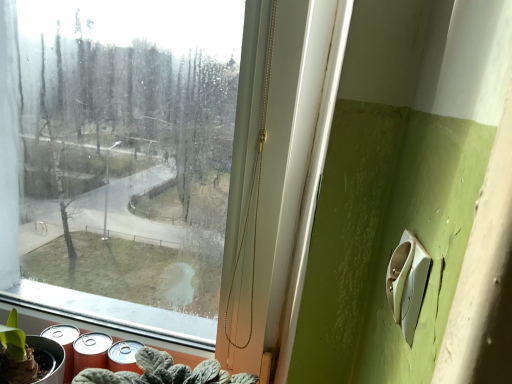
You are a GUI agent. You are given a task and a screenshot of the screen. Output one action in this format:
    pyautogui.click(x=<x>, y=<y>)
    Task: Click on the white plastic light switch at lower right
    This screenshot has height=384, width=512.
    Given the screenshot: What is the action you would take?
    pyautogui.click(x=407, y=283)

Find the location of a particular element. Image resolution: width=512 pixels, height=384 pixels. transparent glass window at center is located at coordinates (119, 145).

Does metallic silver spray can at lower left have a larger size compared to white plastic light switch at lower right?

Yes.

How many degrees apart are the facing directions of metallic silver spray can at lower left and white plastic light switch at lower right?

91.7 degrees.

Is metallic silver spray can at lower left behind white plastic light switch at lower right?

Yes, metallic silver spray can at lower left is further from the viewer.

Are metallic silver spray can at lower left and white plastic light switch at lower right beside each other?

No, metallic silver spray can at lower left is not beside white plastic light switch at lower right.

Can you confirm if green matte plant at lower left is shorter than white plastic light switch at lower right?

No, green matte plant at lower left is not shorter than white plastic light switch at lower right.

Could you tell me if green matte plant at lower left is turned towards white plastic light switch at lower right?

No, green matte plant at lower left does not turn towards white plastic light switch at lower right.

How many degrees apart are the facing directions of green matte plant at lower left and white plastic light switch at lower right?

They differ by 89.6 degrees in their facing directions.

From the image's perspective, between green matte plant at lower left and white plastic light switch at lower right, which one is located above?

white plastic light switch at lower right, from the image's perspective.

Is white plastic light switch at lower right directly adjacent to metallic silver spray can at lower left?

No, white plastic light switch at lower right is not in contact with metallic silver spray can at lower left.

From the image's perspective, is white plastic light switch at lower right above metallic silver spray can at lower left?

Yes.

In terms of width, does white plastic light switch at lower right look wider or thinner when compared to metallic silver spray can at lower left?

white plastic light switch at lower right is thinner than metallic silver spray can at lower left.

Can you confirm if white plastic light switch at lower right is bigger than metallic silver spray can at lower left?

No.

From the image's perspective, is metallic silver spray can at lower left located above or below transparent glass window at center?

metallic silver spray can at lower left is below transparent glass window at center.

From a real-world perspective, which object stands above the other?

From a 3D spatial view, transparent glass window at center is above.

Is metallic silver spray can at lower left in contact with transparent glass window at center?

No, metallic silver spray can at lower left is not with transparent glass window at center.

Is transparent glass window at center located outside white plastic light switch at lower right?

transparent glass window at center lies outside white plastic light switch at lower right's area.

Considering the points (222, 5) and (410, 268), which point is in front, point (222, 5) or point (410, 268)?

Positioned in front is point (410, 268).

From a real-world perspective, is transparent glass window at center positioned over white plastic light switch at lower right based on gravity?

No, from a real-world perspective, transparent glass window at center is not above white plastic light switch at lower right.

How many degrees apart are the facing directions of transparent glass window at center and green matte plant at lower left?

The angle between the facing direction of transparent glass window at center and the facing direction of green matte plant at lower left is 0.0154 degrees.

Which of these two, transparent glass window at center or green matte plant at lower left, is thinner?

With smaller width is green matte plant at lower left.

Between transparent glass window at center and green matte plant at lower left, which one is positioned in front?

transparent glass window at center is closer to the camera.

Which point is more distant from viewer, (x=31, y=241) or (x=15, y=319)?

The point (x=31, y=241) is behind.

Which point is more distant from viewer, (59,346) or (0,85)?

Positioned behind is point (0,85).

Which object is positioned more to the left, green matte plant at lower left or transparent glass window at center?

green matte plant at lower left is more to the left.

Image resolution: width=512 pixels, height=384 pixels. What are the coordinates of `houseplant behind the transparent glass window at center` in the screenshot? It's located at (28, 356).

Considering the relative sizes of green matte plant at lower left and transparent glass window at center in the image provided, is green matte plant at lower left shorter than transparent glass window at center?

Yes.

Where is `spray behind the white plastic light switch at lower right`? spray behind the white plastic light switch at lower right is located at coordinates (91, 351).

Where is `light switch lying in front of the green matte plant at lower left`? light switch lying in front of the green matte plant at lower left is located at coordinates (407, 283).

From the picture: Looking at the image, which one is located further to transparent glass window at center, metallic silver spray can at lower left or green matte plant at lower left?

metallic silver spray can at lower left.

Based on their spatial positions, is transparent glass window at center or white plastic light switch at lower right closer to metallic silver spray can at lower left?

white plastic light switch at lower right lies closer to metallic silver spray can at lower left than the other object.

Which object lies further to the anchor point metallic silver spray can at lower left, white plastic light switch at lower right or transparent glass window at center?

transparent glass window at center.

Looking at the image, which one is located closer to transparent glass window at center, white plastic light switch at lower right or metallic silver spray can at lower left?

Based on the image, metallic silver spray can at lower left appears to be nearer to transparent glass window at center.

Estimate the real-world distances between objects in this image. Which object is further from white plastic light switch at lower right, green matte plant at lower left or metallic silver spray can at lower left?

green matte plant at lower left is positioned further to the anchor white plastic light switch at lower right.

Looking at the image, which one is located further to metallic silver spray can at lower left, green matte plant at lower left or transparent glass window at center?

transparent glass window at center lies further to metallic silver spray can at lower left than the other object.

Estimate the real-world distances between objects in this image. Which object is further from metallic silver spray can at lower left, green matte plant at lower left or white plastic light switch at lower right?

white plastic light switch at lower right is further to metallic silver spray can at lower left.

Consider the image. From the image, which object appears to be nearer to white plastic light switch at lower right, transparent glass window at center or green matte plant at lower left?

green matte plant at lower left is positioned closer to the anchor white plastic light switch at lower right.

The height and width of the screenshot is (384, 512). Identify the location of spray between green matte plant at lower left and white plastic light switch at lower right from left to right. (91, 351).

What are the coordinates of `window between green matte plant at lower left and white plastic light switch at lower right in the horizontal direction` in the screenshot? It's located at (119, 145).

Where is `houseplant between transparent glass window at center and metallic silver spray can at lower left in the up-down direction`? houseplant between transparent glass window at center and metallic silver spray can at lower left in the up-down direction is located at coordinates (28, 356).

Where is `window between metallic silver spray can at lower left and white plastic light switch at lower right`? The image size is (512, 384). window between metallic silver spray can at lower left and white plastic light switch at lower right is located at coordinates (119, 145).